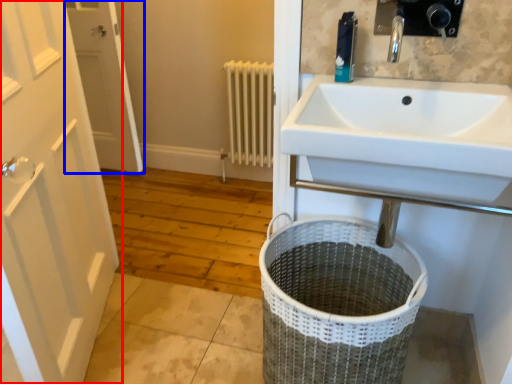
Question: Which object is further to the camera taking this photo, door (highlighted by a red box) or door (highlighted by a blue box)?

Choices:
 (A) door
 (B) door

Answer: (B)